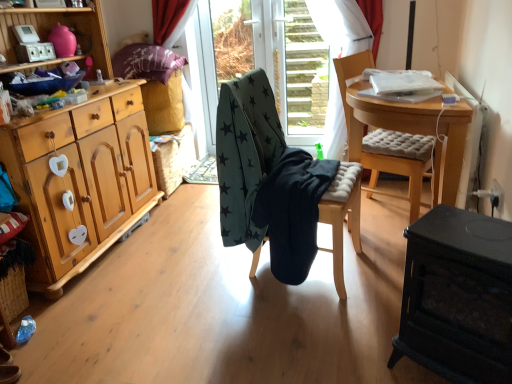
This screenshot has height=384, width=512. Identify the location of free space to the left of teal star-patterned fabric at center, which ranks as the first chair in left-to-right order. (199, 285).